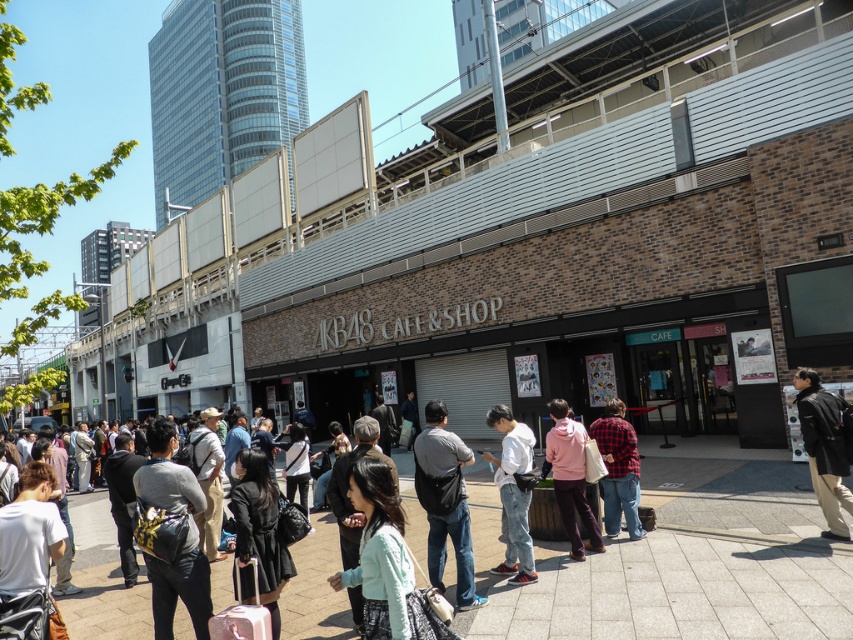
Looking at this image, you are a photographer standing at the point with coordinates (450, 506) in the image. You want to capture a photo of the AKB48 CAFE building while ensuring that your camera doesn not accidentally focus on the gray fabric bag at center. Based on your position, can you adjust your angle to avoid the bag and still frame the building properly?

The point (450, 506) is on the gray fabric bag at center. Since you are standing on the bag, you would need to move away from it to avoid it obstructing the view of the AKB48 CAFE building. Adjusting your angle while remaining on the bag might be challenging, so moving to a different position would be more effective.

You are a delivery person who needs to place a package on the light gray concrete pavement at center. However, there is a white matte jacket at center in the way. Can you place the package there without moving the jacket?

The distance between the light gray concrete pavement at center and the white matte jacket at center is 8.63 feet. Since the jacket is 8.63 feet away from the pavement, you can place the package on the pavement without moving the jacket as they are not in direct contact.

You are a photographer standing at the entrance of the AKB48 CAFE. You see a white matte jacket at center and a red plaid shirt at center in the crowd. You want to take a photo that captures both subjects without them overlapping. Given that your camera has a maximum focus range of 5 feet, will you be able to frame both subjects within the shot?

The white matte jacket at center is 4.79 feet from the red plaid shirt at center. Since the distance between them is less than the camera maximum focus range of 5 feet, you can frame both subjects within the shot without overlapping.